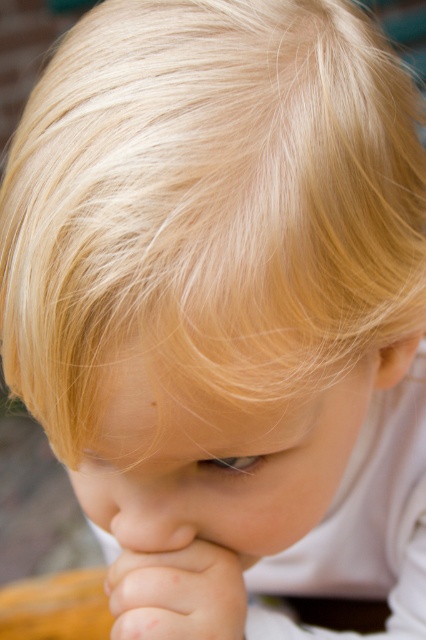
Question: Among these points, which one is farthest from the camera?

Choices:
 (A) (164, 588)
 (B) (161, 157)

Answer: (A)

Question: Can you confirm if blonde silky hair at upper center is positioned to the right of smooth skin hand at lower center?

Choices:
 (A) yes
 (B) no

Answer: (A)

Question: Among these objects, which one is farthest from the camera?

Choices:
 (A) blonde silky hair at upper center
 (B) smooth skin hand at lower center

Answer: (B)

Question: Considering the relative positions of blonde silky hair at upper center and smooth skin hand at lower center in the image provided, where is blonde silky hair at upper center located with respect to smooth skin hand at lower center?

Choices:
 (A) above
 (B) below

Answer: (A)

Question: Considering the relative positions of blonde silky hair at upper center and smooth skin hand at lower center in the image provided, where is blonde silky hair at upper center located with respect to smooth skin hand at lower center?

Choices:
 (A) below
 (B) above

Answer: (B)